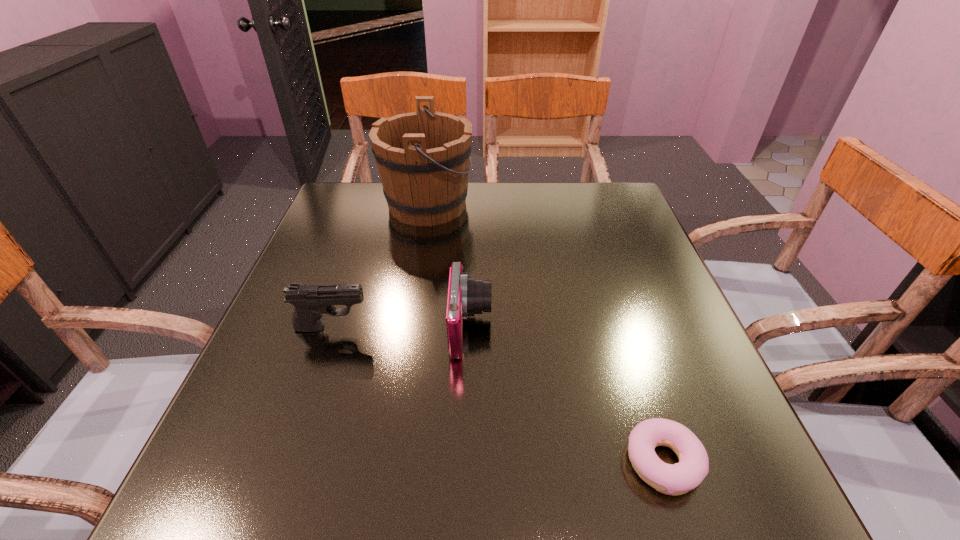
At what (x,y) coordinates should I click in order to perform the action: click on object situated at the far edge. Please return your answer as a coordinate pair (x, y). The height and width of the screenshot is (540, 960). Looking at the image, I should click on (423, 157).

At what (x,y) coordinates should I click in order to perform the action: click on object positioned at the near edge. Please return your answer as a coordinate pair (x, y). Looking at the image, I should click on (675, 479).

Image resolution: width=960 pixels, height=540 pixels. Find the location of `wine bucket present at the left edge`. wine bucket present at the left edge is located at coordinates (423, 157).

This screenshot has height=540, width=960. Find the location of `pistol that is positioned at the left edge`. pistol that is positioned at the left edge is located at coordinates (310, 301).

In order to click on object present at the right edge in this screenshot , I will do `click(675, 479)`.

Where is `object located at the far left corner`? object located at the far left corner is located at coordinates (423, 157).

Find the location of a particular element. The image size is (960, 540). object situated at the near right corner is located at coordinates (675, 479).

Where is `free space at the far edge of the desktop`? The image size is (960, 540). free space at the far edge of the desktop is located at coordinates (392, 227).

Locate an element on the screen. This screenshot has height=540, width=960. vacant space at the near edge of the desktop is located at coordinates (523, 460).

The width and height of the screenshot is (960, 540). In the image, there is a desktop. Identify the location of vacant space at the left edge. (314, 235).